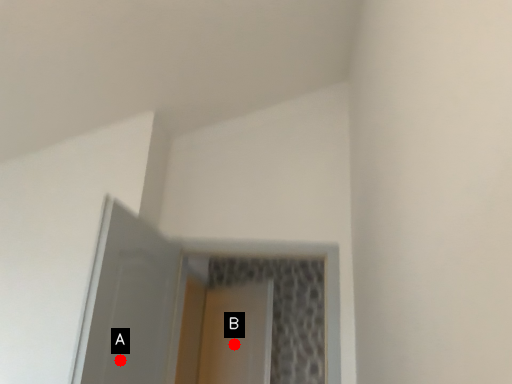
Question: Two points are circled on the image, labeled by A and B beside each circle. Which point is farther from the camera taking this photo?

Choices:
 (A) A is further
 (B) B is further

Answer: (B)